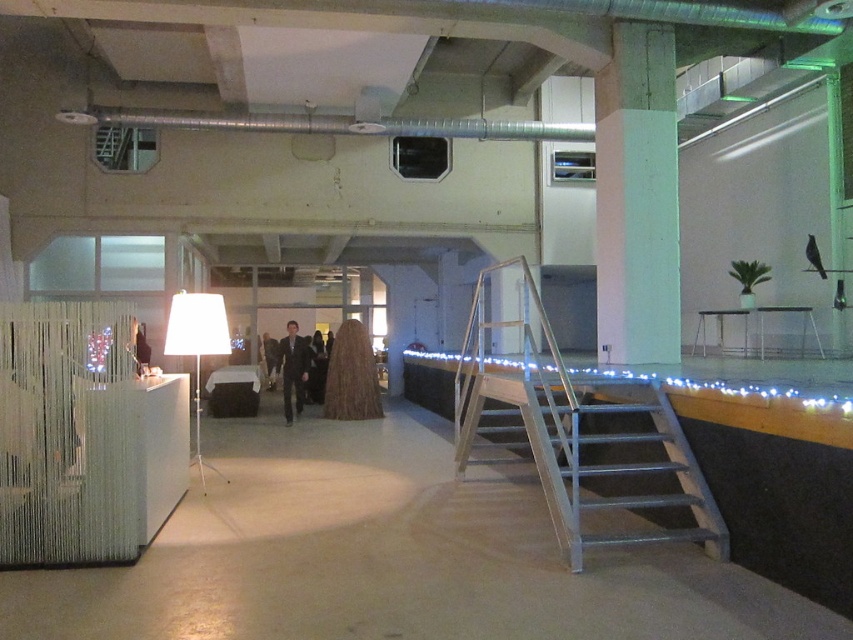
You are standing at the bottom of the metallic gray stairs at center and want to move towards the green concrete pillar at upper right. Which direction should you go?

You should go to the right because the green concrete pillar at upper right is located to the right of the metallic gray stairs at center.

You are standing at the base of the staircase with a 20 feet long ladder. You need to place the ladder against the green concrete pillar at upper right. Is the ladder long enough to reach the pillar from your current position?

The distance between you and the green concrete pillar at upper right is 22.59 feet, which is longer than the ladder length of 20 feet. Therefore, the ladder is not long enough to reach the pillar from your current position.

You are an event planner arranging a formal event in the venue. You need to place a dark gray suit at center and a dark suit at center. According to the scene description, which suit is placed on top of the other?

The dark gray suit at center is positioned over dark suit at center, so the dark gray suit at center is on top of the dark suit at center.